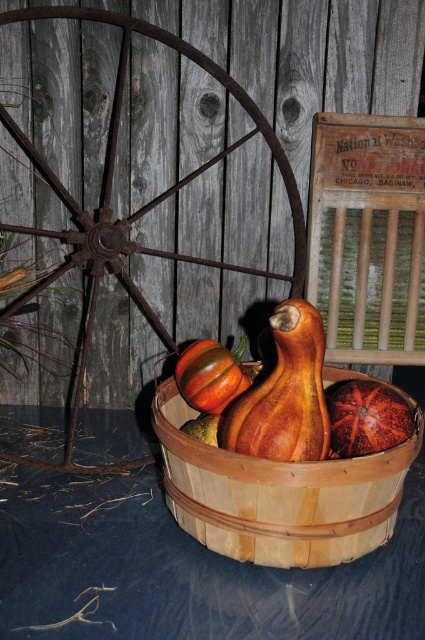
Question: Where is rusty metal wagon wheel at left located in relation to shiny orange pumpkin at center in the image?

Choices:
 (A) below
 (B) above

Answer: (B)

Question: Which object is closer to the camera taking this photo?

Choices:
 (A) green matte gourd at center
 (B) orange textured pumpkin at center
 (C) shiny orange pumpkin at center
 (D) rusty metal wagon wheel at left

Answer: (B)

Question: Can you confirm if rusty metal wagon wheel at left is positioned above orange textured pumpkin at center?

Choices:
 (A) no
 (B) yes

Answer: (B)

Question: Estimate the real-world distances between objects in this image. Which object is farther from the shiny orange pumpkin at center?

Choices:
 (A) orange textured pumpkin at center
 (B) wooden gourd at center

Answer: (A)

Question: Can you confirm if wooden gourd at center is positioned below green matte gourd at center?

Choices:
 (A) no
 (B) yes

Answer: (A)

Question: Which of these objects is positioned closest to the orange textured pumpkin at center?

Choices:
 (A) rusty metal wagon wheel at left
 (B) wooden gourd at center
 (C) green matte gourd at center
 (D) shiny orange pumpkin at center

Answer: (B)